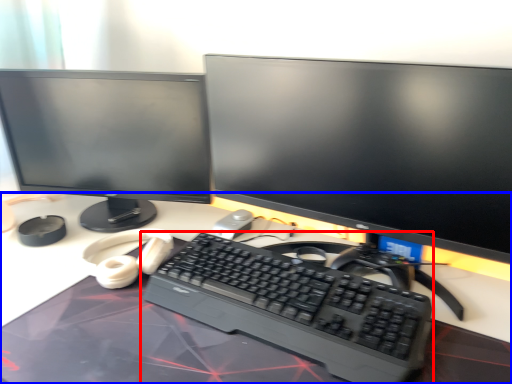
Question: Which point is further to the camera, computer keyboard (highlighted by a red box) or desk (highlighted by a blue box)?

Choices:
 (A) computer keyboard
 (B) desk

Answer: (A)